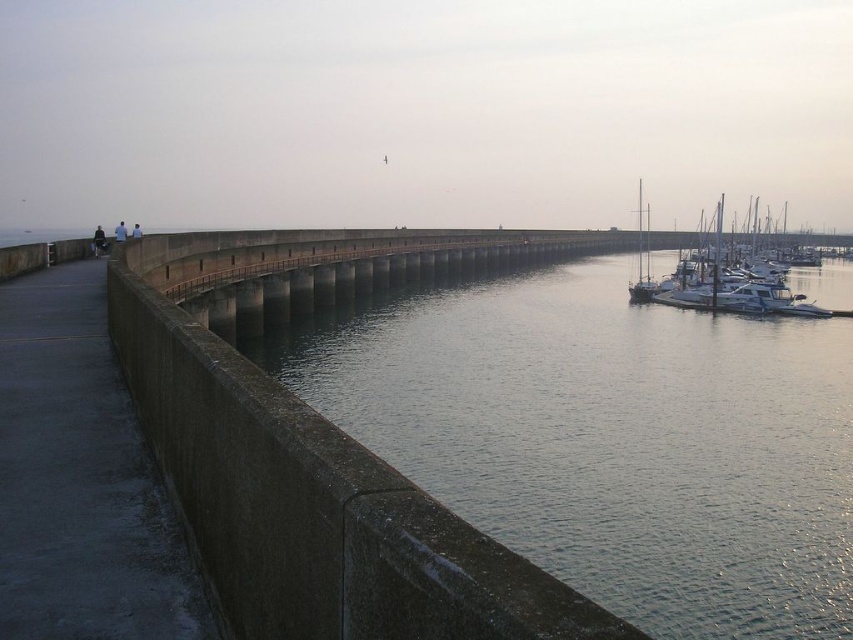
Question: Is silver metallic sailboat at right above dark blue jeans at left?

Choices:
 (A) no
 (B) yes

Answer: (B)

Question: Among these objects, which one is nearest to the camera?

Choices:
 (A) smooth concrete water at center
 (B) white glossy sailboat at right
 (C) silver metallic sailboat at right
 (D) dark blue jeans at left

Answer: (A)

Question: Is smooth concrete water at center bigger than white glossy sailboat at right?

Choices:
 (A) yes
 (B) no

Answer: (B)

Question: Among these objects, which one is farthest from the camera?

Choices:
 (A) silver metallic sailboat at right
 (B) white glossy sailboat at right
 (C) dark blue jeans at left

Answer: (A)

Question: Can you confirm if white glossy sailboat at right is positioned below dark blue jeans at left?

Choices:
 (A) yes
 (B) no

Answer: (B)

Question: Based on their relative distances, which object is nearer to the dark blue jeans at left?

Choices:
 (A) white glossy sailboat at right
 (B) smooth concrete water at center

Answer: (B)